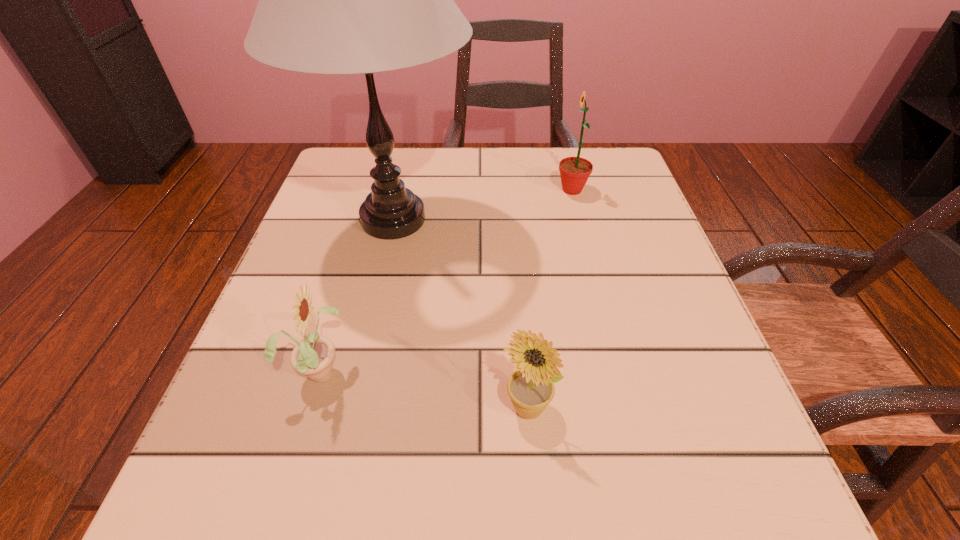
This screenshot has width=960, height=540. Identify the location of free space at the right edge of the desktop. (x=714, y=374).

Locate an element on the screen. The width and height of the screenshot is (960, 540). vacant space at the far left corner of the desktop is located at coordinates (350, 154).

In the image, there is a desktop. Identify the location of vacant area at the far right corner. (600, 167).

Find the location of a particular element. The height and width of the screenshot is (540, 960). vacant region between the tallest object and the second sunflower from left to right is located at coordinates click(x=461, y=314).

At what (x,y) coordinates should I click in order to perform the action: click on free area in between the leftmost sunflower and the second sunflower from left to right. Please return your answer as a coordinate pair (x, y). This screenshot has width=960, height=540. Looking at the image, I should click on (423, 389).

At what (x,y) coordinates should I click in order to perform the action: click on vacant point located between the lamp and the leftmost sunflower. Please return your answer as a coordinate pair (x, y). Looking at the image, I should click on (357, 295).

Image resolution: width=960 pixels, height=540 pixels. In order to click on empty space that is in between the second sunflower from right to left and the lamp in this screenshot , I will do `click(461, 314)`.

Identify the location of vacant space that's between the rightmost sunflower and the tallest object. (483, 205).

I want to click on unoccupied position between the leftmost sunflower and the third object from left to right, so click(x=423, y=389).

This screenshot has height=540, width=960. Identify the location of free area in between the lamp and the leftmost sunflower. (357, 295).